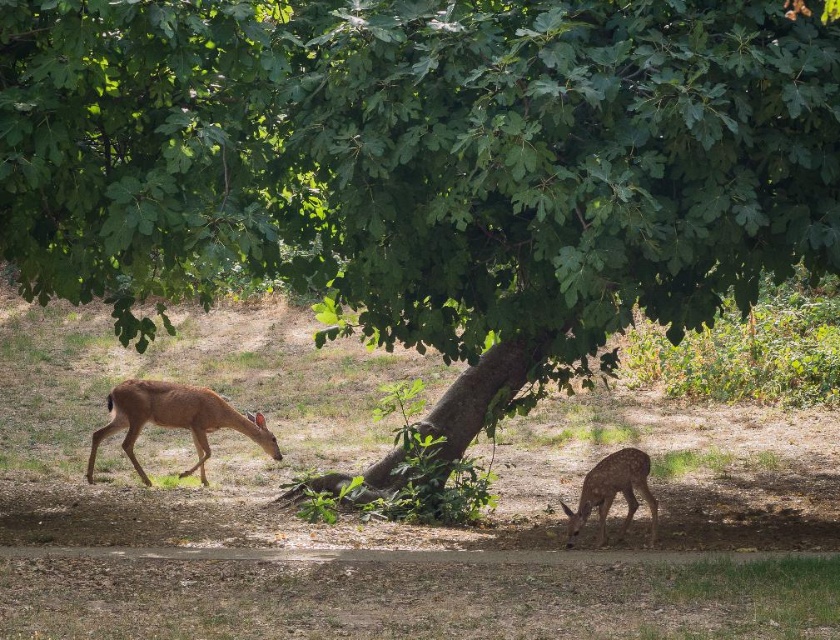
Is brown matte/deer at left closer to camera compared to brown matte/deer at lower right?

No, brown matte/deer at left is further to the viewer.

Is point (218, 404) behind point (588, 513)?

Yes, it is behind point (588, 513).

Does point (134, 390) lie behind point (606, 456)?

Yes, it is.

This screenshot has height=640, width=840. I want to click on brown matte/deer at left, so click(176, 419).